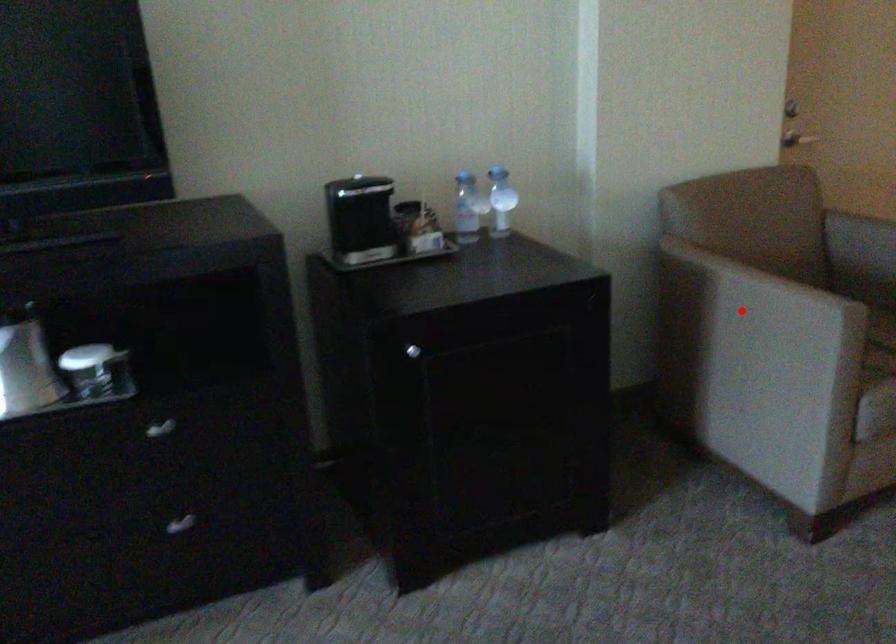
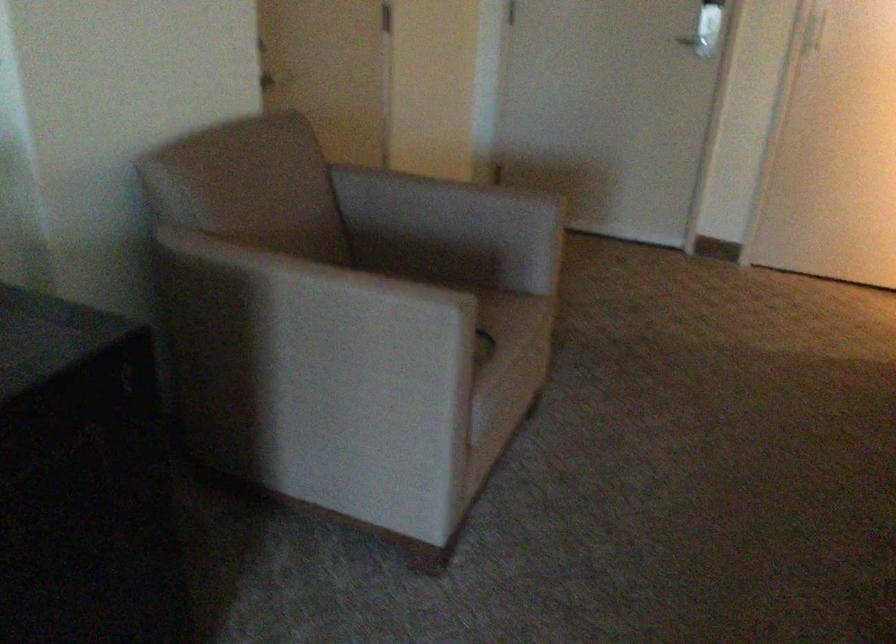
Question: I am providing you with two images of the same scene from different viewpoints. A red point is marked on the first image. Is the red point's position out of view in image 2?

Choices:
 (A) Yes
 (B) No

Answer: (B)